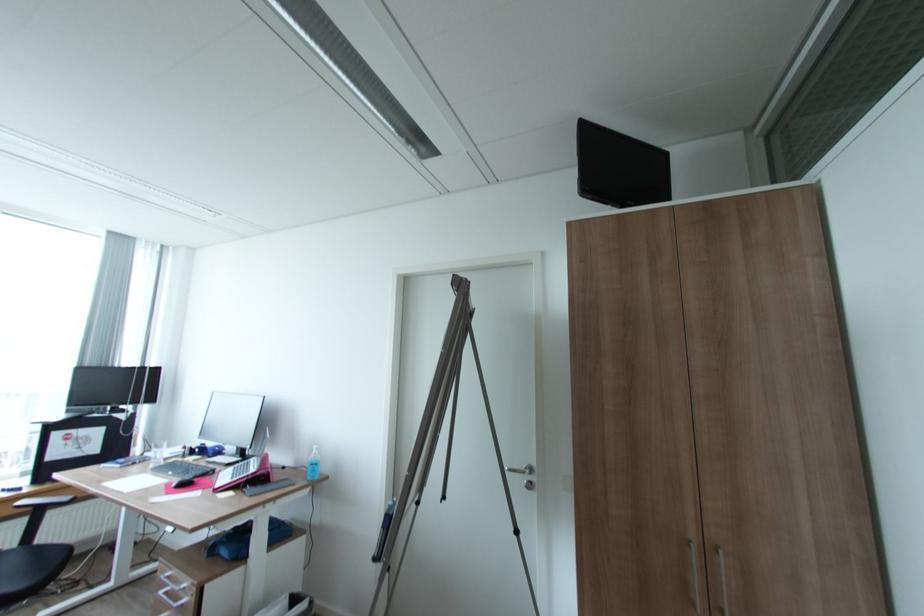
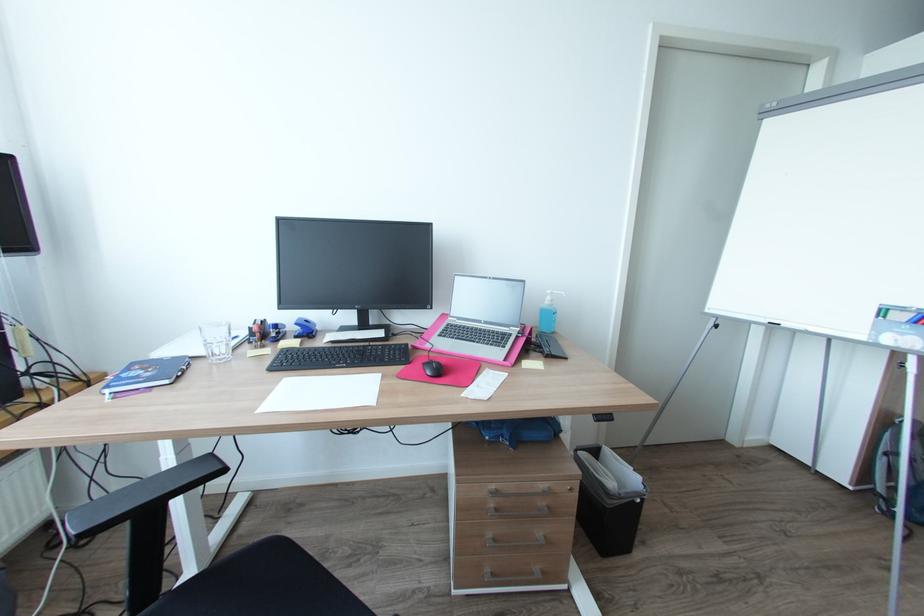
Locate, in the second image, the point that corresponds to pixel 124 464 in the first image.

(171, 381)